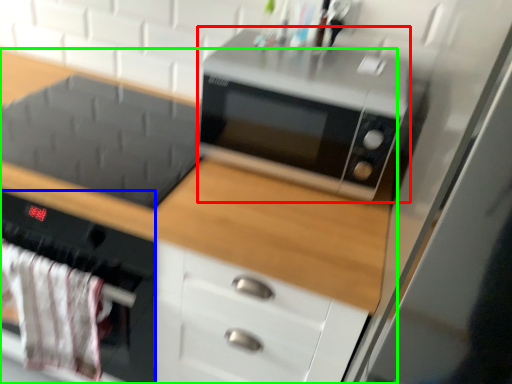
Question: Considering the real-world distances, which object is closest to microwave oven (highlighted by a red box)? oven (highlighted by a blue box) or cabinetry (highlighted by a green box).

Choices:
 (A) oven
 (B) cabinetry

Answer: (B)